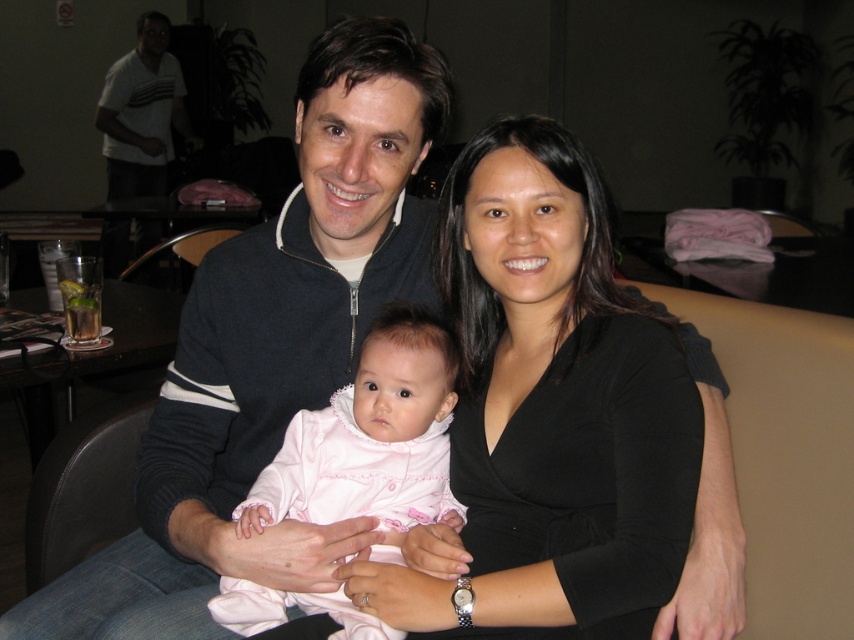
Question: Can you confirm if pink soft fabric baby at center is positioned below white striped t-shirt at upper left?

Choices:
 (A) yes
 (B) no

Answer: (A)

Question: Which is farther from the pink soft fabric baby at center?

Choices:
 (A) black matte shirt at center
 (B) white striped t-shirt at upper left

Answer: (B)

Question: Which point appears closest to the camera in this image?

Choices:
 (A) (341, 589)
 (B) (177, 128)

Answer: (A)

Question: Is black matte shirt at center further to camera compared to pink soft fabric baby at center?

Choices:
 (A) yes
 (B) no

Answer: (B)

Question: Which object is closer to the camera taking this photo?

Choices:
 (A) black matte shirt at center
 (B) pink soft fabric baby at center
 (C) white striped t-shirt at upper left

Answer: (A)

Question: Does black matte shirt at center lie in front of pink soft fabric baby at center?

Choices:
 (A) yes
 (B) no

Answer: (A)